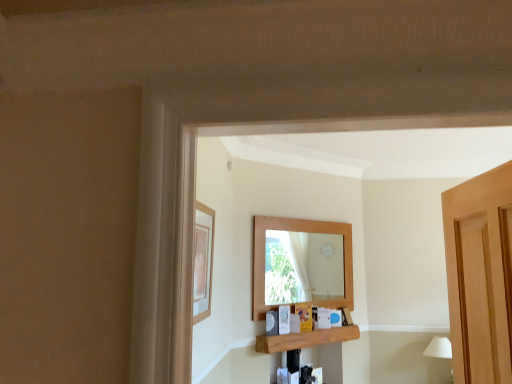
Question: Which is correct: white matte lampshade at lower right is inside wooden shelf at center, or outside of it?

Choices:
 (A) outside
 (B) inside

Answer: (A)

Question: Looking at the image, does white matte lampshade at lower right seem bigger or smaller compared to wooden shelf at center?

Choices:
 (A) small
 (B) big

Answer: (B)

Question: Which of these objects is positioned farthest from the matte wooden picture frame at upper left?

Choices:
 (A) wooden shelf at center
 (B) white matte lampshade at lower right

Answer: (B)

Question: Considering the real-world distances, which object is farthest from the wooden shelf at center?

Choices:
 (A) white matte lampshade at lower right
 (B) matte wooden picture frame at upper left

Answer: (B)